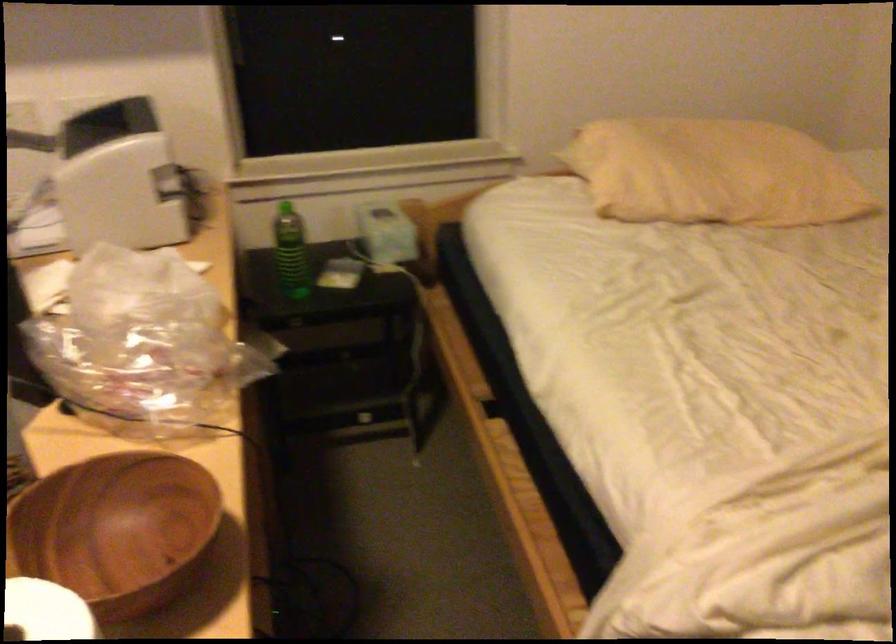
Which object does [712,173] point to?

It corresponds to the yellow pillow in the image.